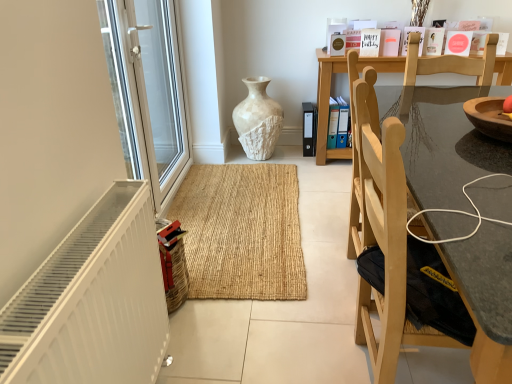
The width and height of the screenshot is (512, 384). I want to click on free point in front of white textured vase at center, so [269, 172].